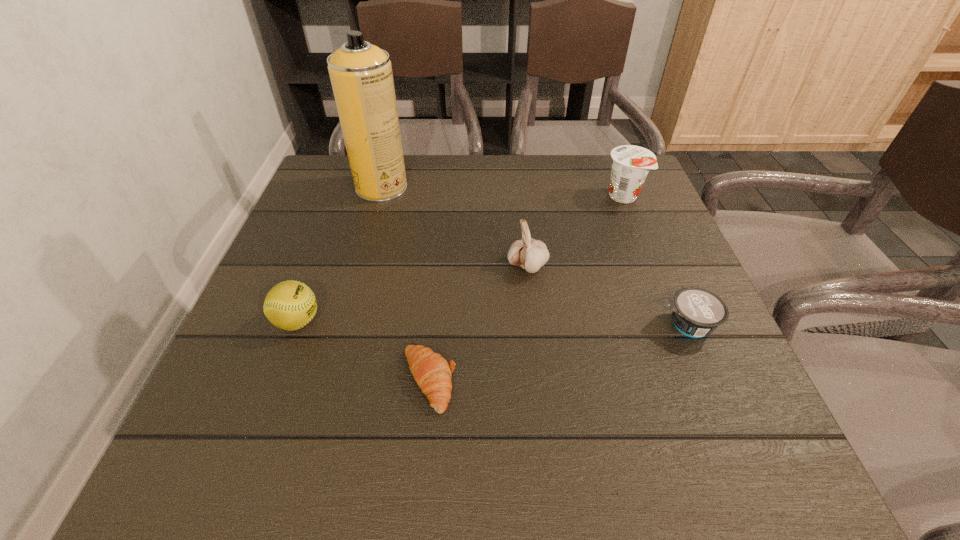
You are a GUI agent. You are given a task and a screenshot of the screen. Output one action in this format:
    pyautogui.click(x=<x>, y=<y>)
    Task: Click on the tallest object
    Image resolution: width=960 pixels, height=540 pixels.
    Given the screenshot: What is the action you would take?
    pyautogui.click(x=361, y=76)

This screenshot has width=960, height=540. Identify the location of the farther yogurt. (630, 164).

Locate an element on the screen. This screenshot has height=540, width=960. the third farthest object is located at coordinates (530, 254).

Identify the location of the fourth object from left to right. This screenshot has height=540, width=960. (530, 254).

This screenshot has height=540, width=960. I want to click on softball, so click(290, 305).

Find the location of `the shorter yogurt`. the shorter yogurt is located at coordinates (696, 312).

I want to click on the nearer yogurt, so click(x=696, y=312).

Image resolution: width=960 pixels, height=540 pixels. I want to click on the fourth object from right to left, so [432, 373].

Find the location of a particular element. the shortest object is located at coordinates pos(432,373).

Find the location of a particular element. The image size is (960, 540). vacant region located 0.330m on the front of the tallest object is located at coordinates (348, 305).